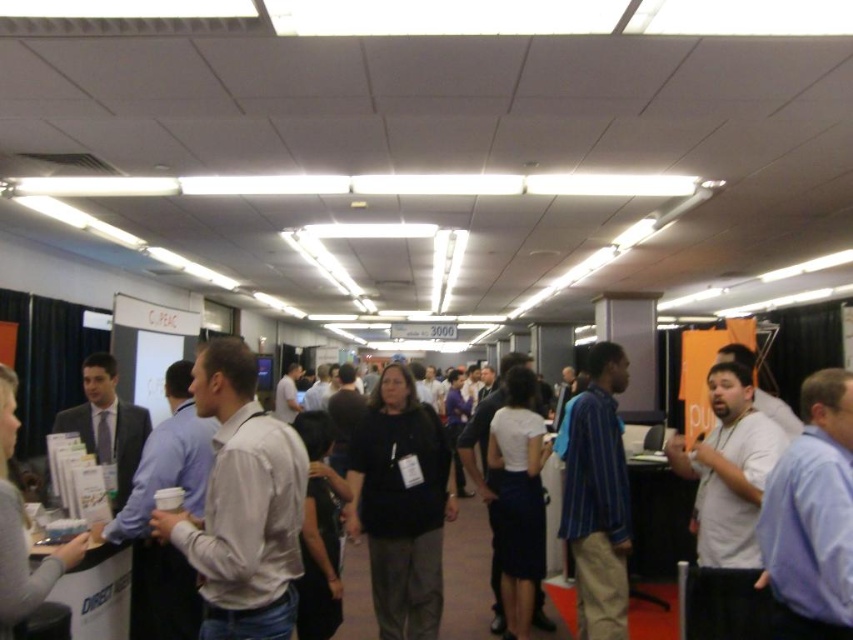
You are an event planner standing in the middle of the corridor. You notice two attendees wearing white shirts. One is labeled as the white shirt at left and the other as the white matte shirt at right. Which attendee is positioned farther to the left side of the corridor?

The white shirt at left is positioned farther to the left side of the corridor compared to the white matte shirt at right.

You are an attendee at a conference and you see a white shirt at left and a striped cotton shirt at center. Which one is more to the left?

The white shirt at left is more to the left.